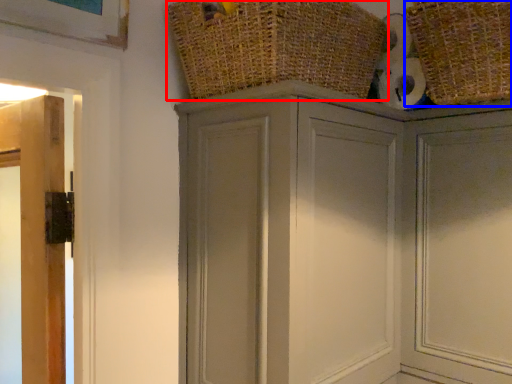
Question: Among these objects, which one is nearest to the camera, basket (highlighted by a red box) or basket (highlighted by a blue box)?

Choices:
 (A) basket
 (B) basket

Answer: (A)